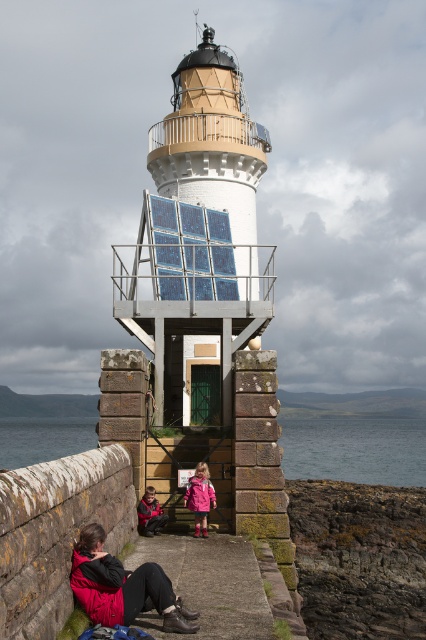
You are standing on the platform near the lighthouse and want to reach the blue water at lower center without getting wet. The matte black jacket at lower left is blocking your path. Can you walk around it to reach the water? Explain your reasoning based on the distance provided.

The distance between the blue water at lower center and the matte black jacket at lower left is 142.95 meters. Since the jacket is only blocking part of the path and the distance is quite large, you can likely walk around the jacket to reach the water without getting wet.

You are standing at the base of the lighthouse and want to place a 1.5 meter wide wooden bench between the blue water at lower center and the matte black jacket at lower left. Can the bench fit between them?

The blue water at lower center is wider than the matte black jacket at lower left. However, the exact distance between them isn

In the scene shown: You are standing at the base of the lighthouse and want to reach the blue water at lower center. Which direction should you head towards?

The blue water at lower center is located at point 0.703 in the x coordinate and 0.836 in the y coordinate, so you should head towards the lower center direction to reach it.